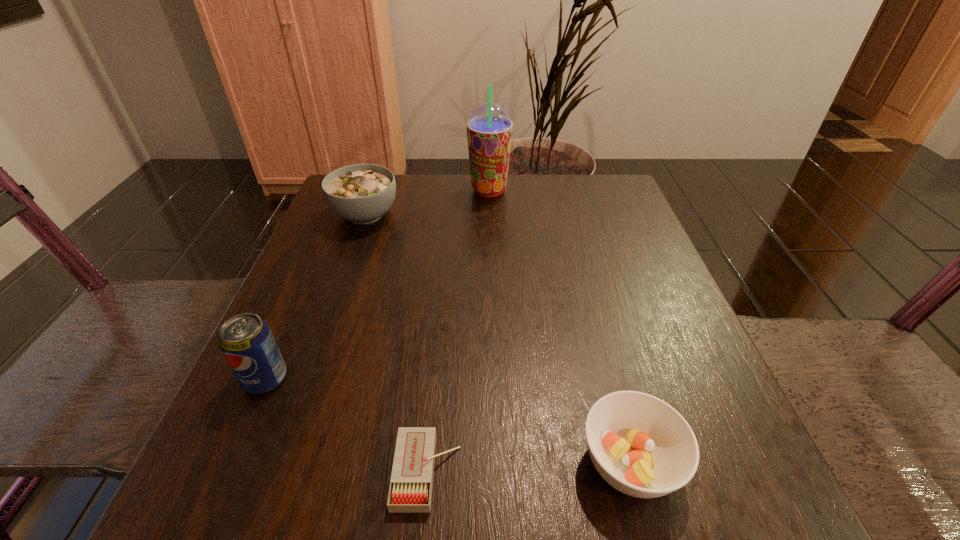
The image size is (960, 540). Identify the location of free space between the tallest object and the left soup bowl. (427, 202).

The image size is (960, 540). What are the coordinates of `blank region between the matchbox and the third shortest object` in the screenshot? It's located at (396, 343).

Where is `free space that is in between the taller soup bowl and the soda`? The image size is (960, 540). free space that is in between the taller soup bowl and the soda is located at coordinates (316, 296).

You are a GUI agent. You are given a task and a screenshot of the screen. Output one action in this format:
    pyautogui.click(x=<x>, y=<y>)
    Task: Click on the vacant area that lies between the shortest object and the fourth tallest object
    
    Given the screenshot: What is the action you would take?
    pyautogui.click(x=528, y=467)

Find the location of `free space between the taller soup bowl and the rightmost object`. free space between the taller soup bowl and the rightmost object is located at coordinates (497, 339).

Identify the location of vacant point located between the matchbox and the second tallest object. The width and height of the screenshot is (960, 540). (347, 425).

This screenshot has height=540, width=960. I want to click on free spot between the farther soup bowl and the third nearest object, so click(316, 296).

Where is `unoccupied area between the soda and the matchbox`? This screenshot has width=960, height=540. unoccupied area between the soda and the matchbox is located at coordinates (347, 425).

The width and height of the screenshot is (960, 540). In order to click on free area in between the fourth shortest object and the taller soup bowl in this screenshot , I will do `click(316, 296)`.

Identify which object is located as the nearest to the taller soup bowl. Please provide its 2D coordinates. Your answer should be formatted as a tuple, i.e. [(x, y)], where the tuple contains the x and y coordinates of a point satisfying the conditions above.

[(489, 127)]